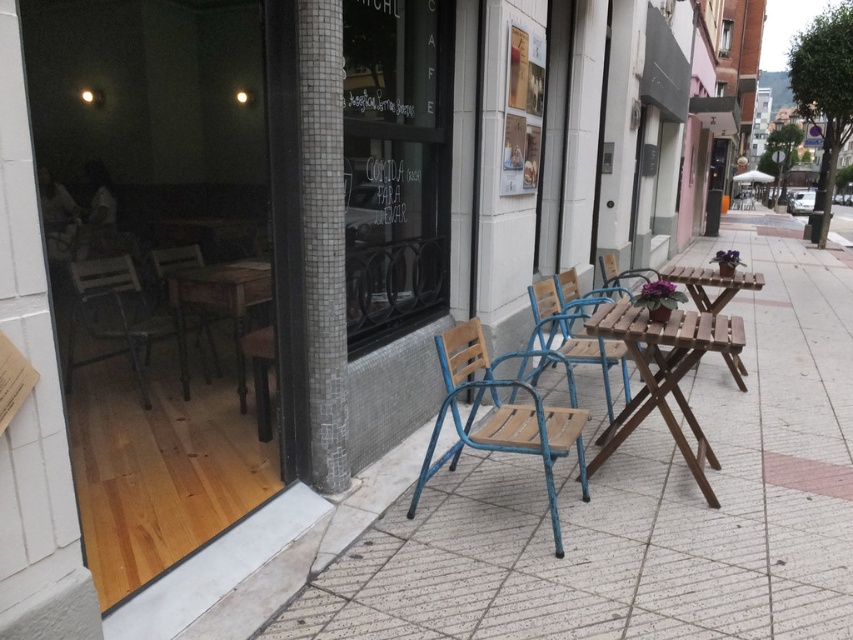
You are standing in front of the cafe entrance and want to place a small potted plant between the wooden pavement at center and the wooden chair at left. Based on their positions, where should you place the plant?

The wooden pavement at center is to the right of the wooden chair at left, so you should place the small potted plant between them on the right side of the wooden chair at left and the left side of the wooden pavement at center.

You are a delivery person trying to place a heavy box on the wooden pavement at center. However, you notice the wooden table at left nearby. Which surface is higher and more suitable for placing the box to avoid water accumulation?

The wooden pavement at center is taller than wooden table at left, so placing the box on the wooden pavement at center would be higher and better to avoid water accumulation.

You are a delivery person trying to place a heavy box on the wooden pavement at center. However, there is a wooden chair at left in the way. Can you move the chair to the side to make space?

The wooden pavement at center is taller than wooden chair at left, so the chair can be moved aside to create space for placing the box on the pavement.